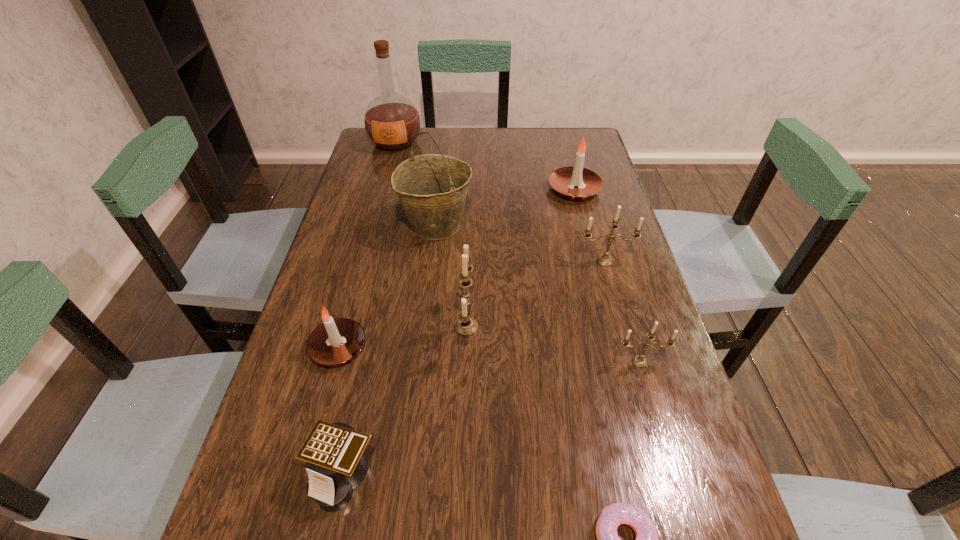
This screenshot has width=960, height=540. Identify the location of vacant region at the far right corner of the desktop. (583, 131).

The width and height of the screenshot is (960, 540). Find the location of `free point between the smaller white candle and the farther white candle`. free point between the smaller white candle and the farther white candle is located at coordinates (456, 268).

What are the coordinates of `unoccupied position between the calculator and the leftmost metallic candle` in the screenshot? It's located at (405, 401).

In order to click on unoccupied position between the second farthest candle and the tallest candle in this screenshot , I will do pos(536,294).

This screenshot has height=540, width=960. I want to click on vacant space in between the third tallest object and the right white candle, so click(x=520, y=258).

Image resolution: width=960 pixels, height=540 pixels. What are the coordinates of `free spot between the eighth shortest object and the calculator` in the screenshot? It's located at (390, 350).

Image resolution: width=960 pixels, height=540 pixels. Identify the location of unoccupied position between the bigger white candle and the biggest metallic candle. (520, 258).

The height and width of the screenshot is (540, 960). I want to click on free spot between the tallest candle and the second tallest object, so click(451, 276).

Point out which object is positioned as the seventh nearest to the wine bucket. Please provide its 2D coordinates. Your answer should be formatted as a tuple, i.e. [(x, y)], where the tuple contains the x and y coordinates of a point satisfying the conditions above.

[(335, 452)]

Select which object is the third closest to the leftmost metallic candle. Please provide its 2D coordinates. Your answer should be formatted as a tuple, i.e. [(x, y)], where the tuple contains the x and y coordinates of a point satisfying the conditions above.

[(335, 452)]